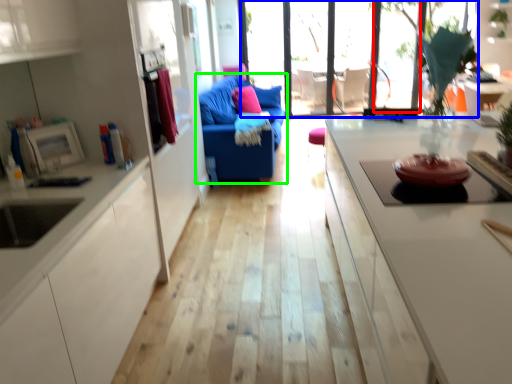
Question: Based on their relative distances, which object is farther from window (highlighted by a red box)? Choose from window (highlighted by a blue box) and studio couch (highlighted by a green box).

Choices:
 (A) window
 (B) studio couch

Answer: (B)